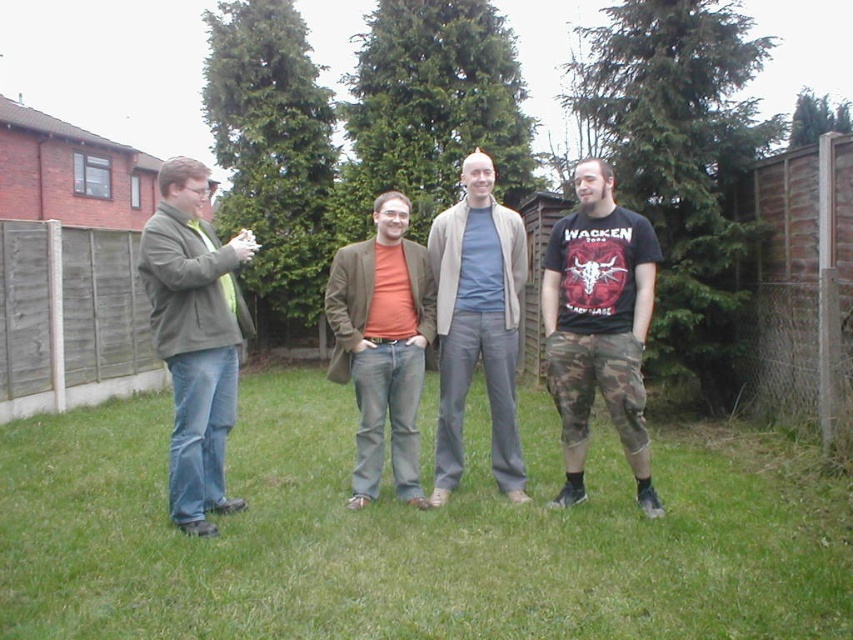
You are standing on the green grass at lower center and want to walk towards the light gray cotton pants at center. In which direction should you move?

You should move to the right because the green grass at lower center is positioned on the left side of light gray cotton pants at center.

You are a photographer trying to capture a group photo of the matte green jacket at left and the light gray cotton pants at center. Since you want to ensure both subjects are in focus, you need to know which one is narrower. Which object is narrower?

The matte green jacket at left is narrower than the light gray cotton pants at center, so you should adjust your camera settings to focus on the narrower object first.